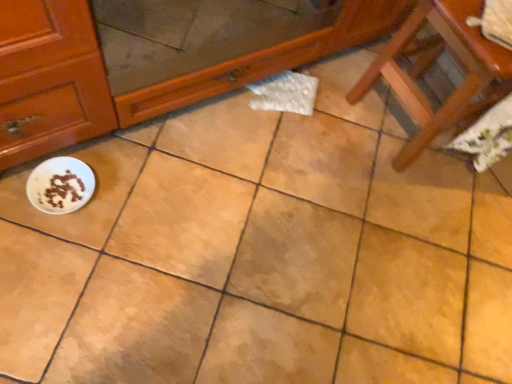
Question: In the image, is white glossy bowl at lower left positioned in front of or behind wooden chair at lower right?

Choices:
 (A) behind
 (B) front

Answer: (A)

Question: Would you say white glossy bowl at lower left is inside or outside wooden chair at lower right?

Choices:
 (A) outside
 (B) inside

Answer: (A)

Question: From the image's perspective, is white glossy bowl at lower left above or below wooden chair at lower right?

Choices:
 (A) above
 (B) below

Answer: (B)

Question: Considering the positions of point (411, 82) and point (34, 178), is point (411, 82) closer or farther from the camera than point (34, 178)?

Choices:
 (A) farther
 (B) closer

Answer: (A)

Question: Is wooden chair at lower right inside or outside of white glossy bowl at lower left?

Choices:
 (A) outside
 (B) inside

Answer: (A)

Question: Considering the positions of wooden chair at lower right and white glossy bowl at lower left in the image, is wooden chair at lower right bigger or smaller than white glossy bowl at lower left?

Choices:
 (A) small
 (B) big

Answer: (B)

Question: Relative to white glossy bowl at lower left, is wooden chair at lower right in front or behind?

Choices:
 (A) front
 (B) behind

Answer: (A)